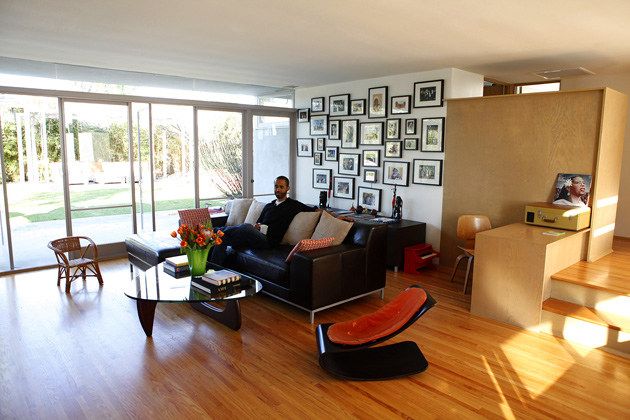
Locate an element on the screen. This screenshot has width=630, height=420. ceiling above couch is located at coordinates (273, 40).